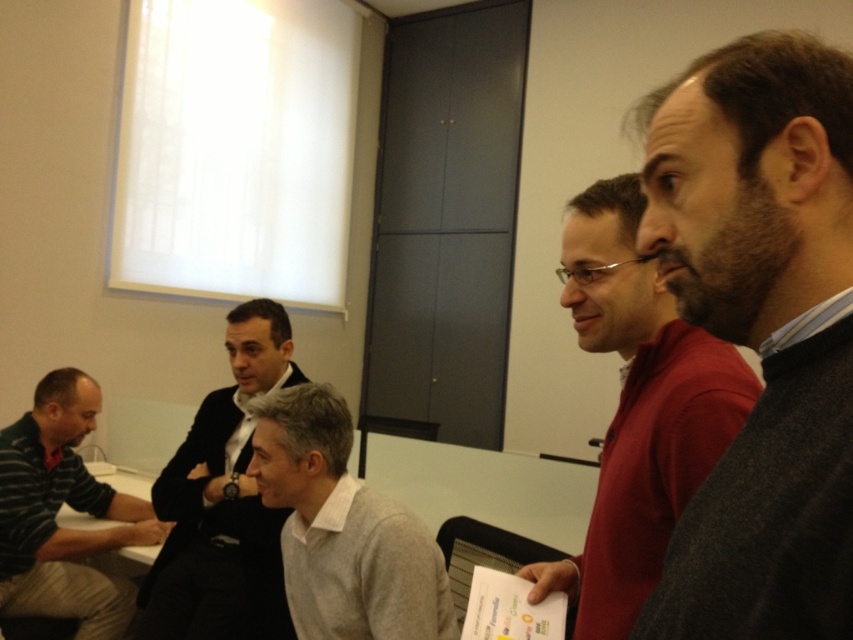
You are standing in the conference room and want to move from point A at point (747, 534) to point B at point (311, 451). Is point A closer to the window compared to point B?

Point A at point (747, 534) is in front of point B at point (311, 451), so point A is closer to the window than point B.

Please describe the position of the dark gray sweater at right relative to the point marked at coordinates [761,332].

The point marked at coordinates [761,332] corresponds exactly to the dark gray sweater at right.

You are a photographer in the room and want to take a photo of both the dark gray sweater at right and the light gray sweater at center. Which one will appear closer to the camera in the photo?

The dark gray sweater at right will appear closer to the camera in the photo because it is positioned in front of the light gray sweater at center.